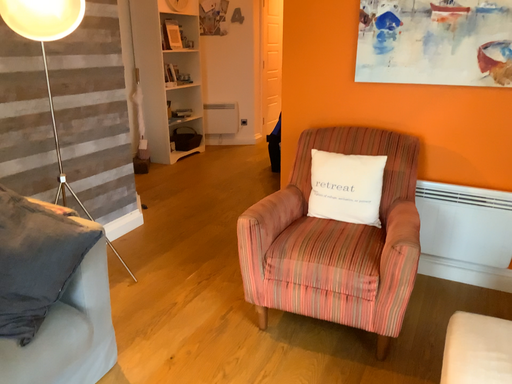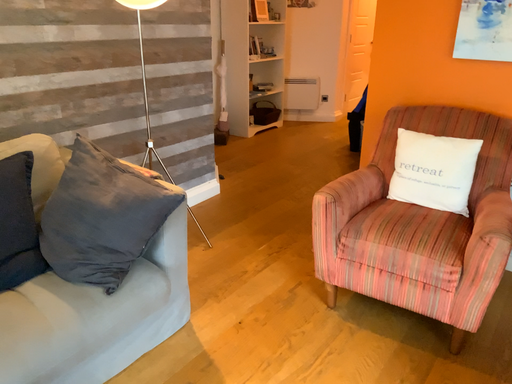
Question: Which way did the camera rotate in the video?

Choices:
 (A) rotated right
 (B) rotated left

Answer: (B)